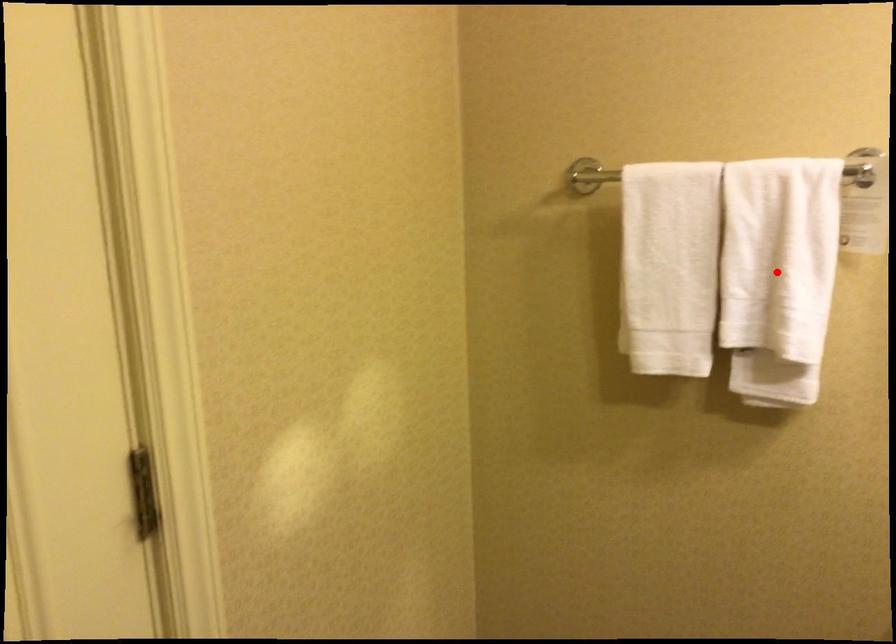
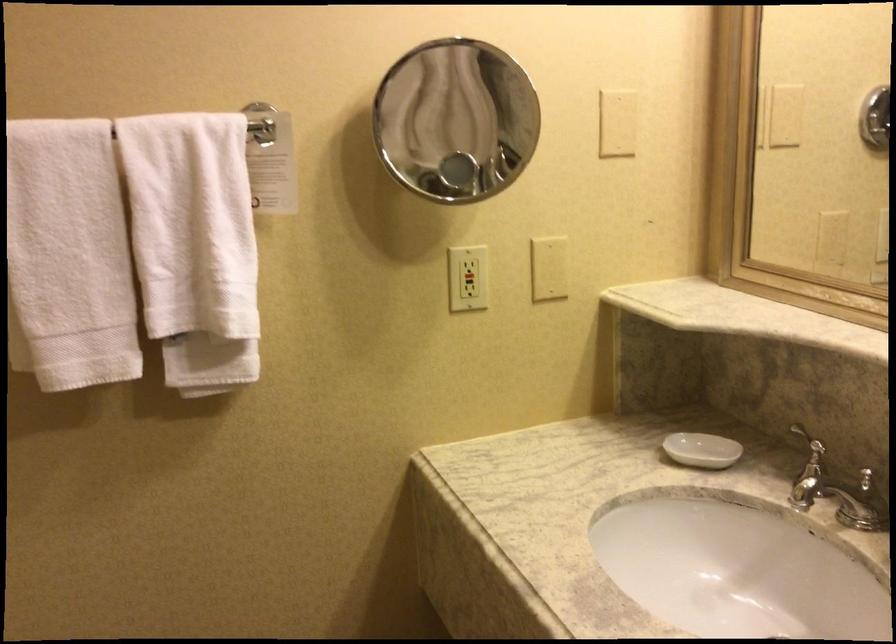
Question: I am providing you with two images of the same scene from different viewpoints. In image1, a red point is highlighted. Considering the same 3D point in image2, which of the following is correct?

Choices:
 (A) It is closer
 (B) It is farther

Answer: (A)